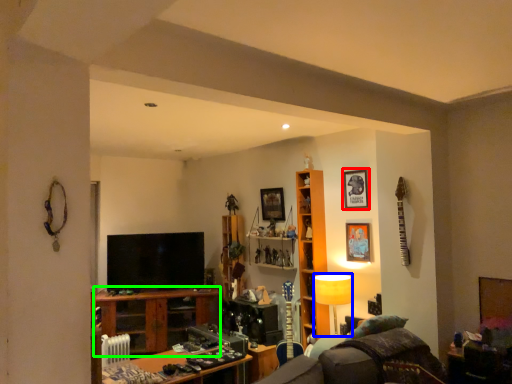
Question: Estimate the real-world distances between objects in this image. Which object is closer to picture frame (highlighted by a red box), lamp (highlighted by a blue box) or table (highlighted by a green box)?

Choices:
 (A) lamp
 (B) table

Answer: (A)